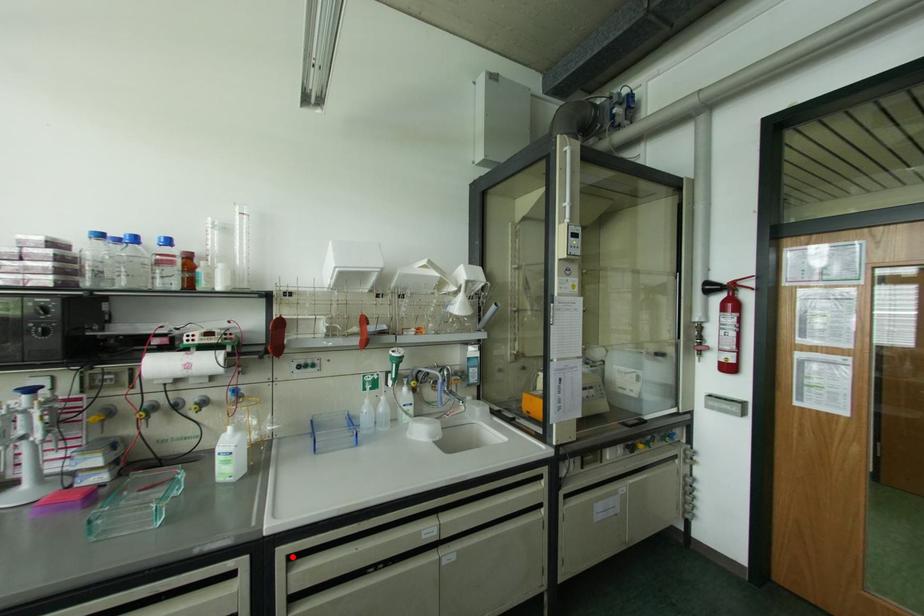
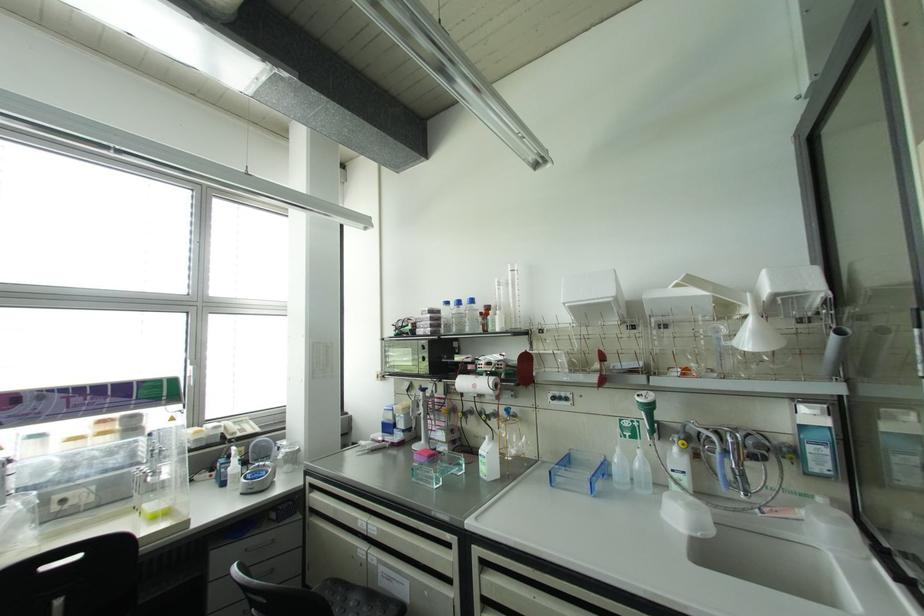
In the second image, find the point that corresponds to the highlighted location in the first image.

(482, 562)